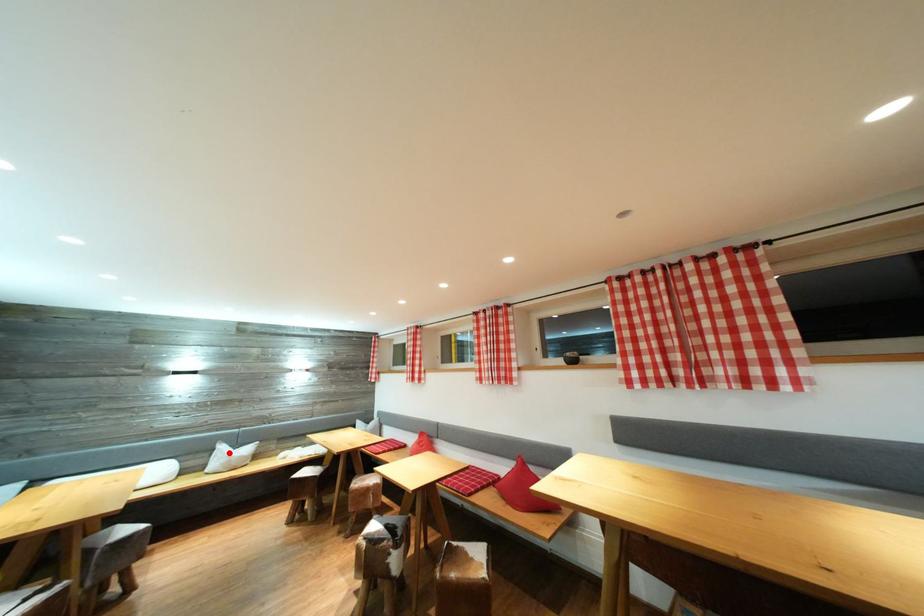
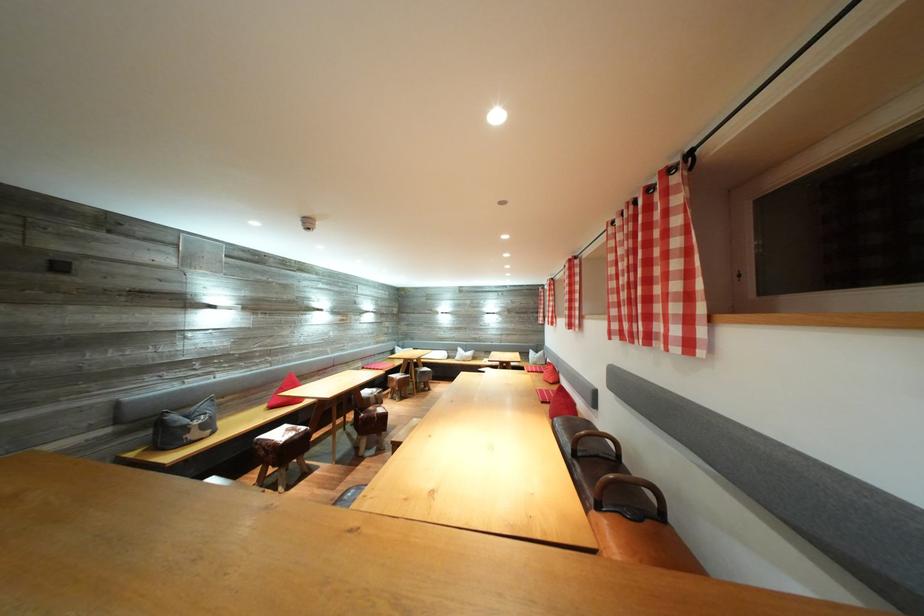
The point at the highlighted location is marked in the first image. Where is the corresponding point in the second image?

(467, 355)